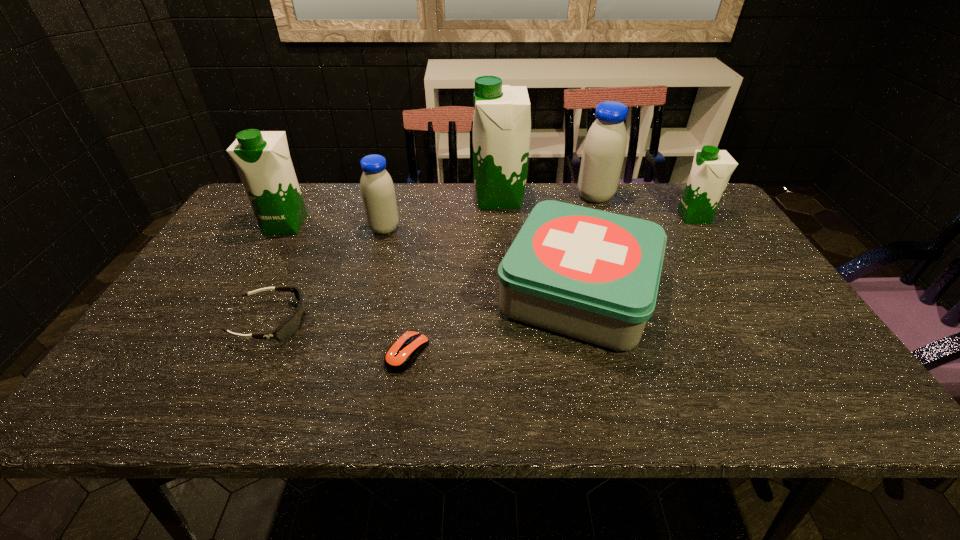
Image resolution: width=960 pixels, height=540 pixels. Identify the location of the first-aid kit. (593, 275).

The height and width of the screenshot is (540, 960). Find the location of `the third shortest object`. the third shortest object is located at coordinates (593, 275).

This screenshot has width=960, height=540. Identify the location of goggles. (293, 323).

This screenshot has width=960, height=540. In order to click on the shortest object in this screenshot , I will do `click(400, 356)`.

Identify the location of computer mouse. This screenshot has width=960, height=540. (400, 356).

Image resolution: width=960 pixels, height=540 pixels. Identify the location of vacant space located 0.370m on the front-facing side of the third soya milk from right to left. (360, 198).

Where is `vacant space located on the front-facing side of the third soya milk from right to left`? This screenshot has width=960, height=540. vacant space located on the front-facing side of the third soya milk from right to left is located at coordinates (440, 198).

This screenshot has height=540, width=960. In order to click on vacant space located on the front-facing side of the third soya milk from right to left in this screenshot , I will do `click(412, 198)`.

Find the location of a particular element. The image size is (960, 540). blank space located on the front of the bigger blue soya milk is located at coordinates (618, 260).

Find the location of a particular element. vacant point located 0.220m on the front-facing side of the leftmost soya milk is located at coordinates (249, 289).